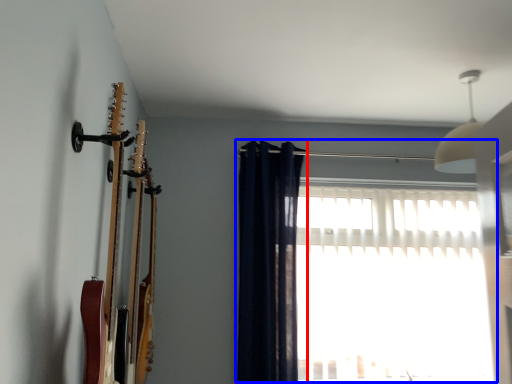
Question: Which point is further to the camera, curtain (highlighted by a red box) or window (highlighted by a blue box)?

Choices:
 (A) curtain
 (B) window

Answer: (B)